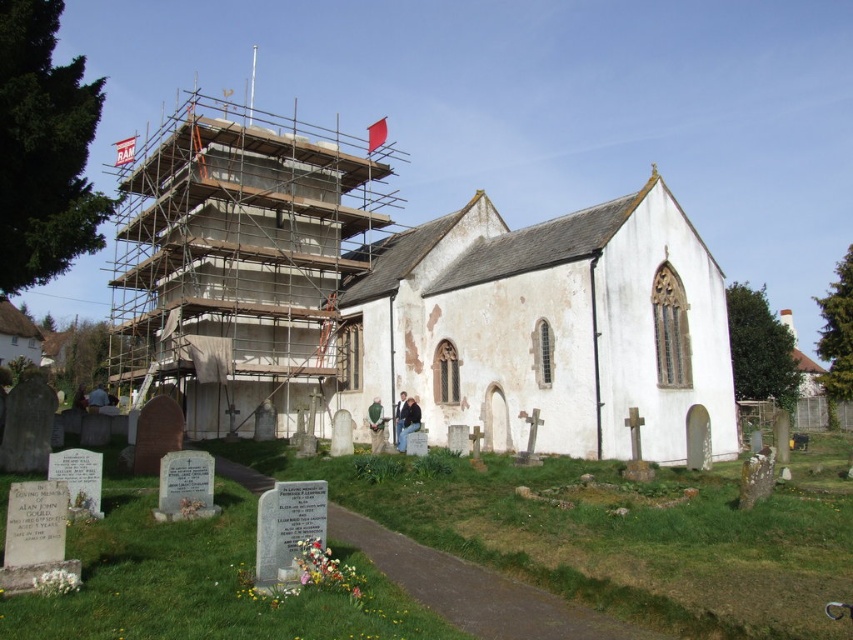
Does point (468, 420) lie behind point (277, 388)?

No.

Is white stone chapel at center to the right of concrete scaffolding at center from the viewer's perspective?

Correct, you'll find white stone chapel at center to the right of concrete scaffolding at center.

This screenshot has height=640, width=853. In order to click on white stone chapel at center in this screenshot , I will do `click(547, 326)`.

Image resolution: width=853 pixels, height=640 pixels. I want to click on white stone chapel at center, so click(x=547, y=326).